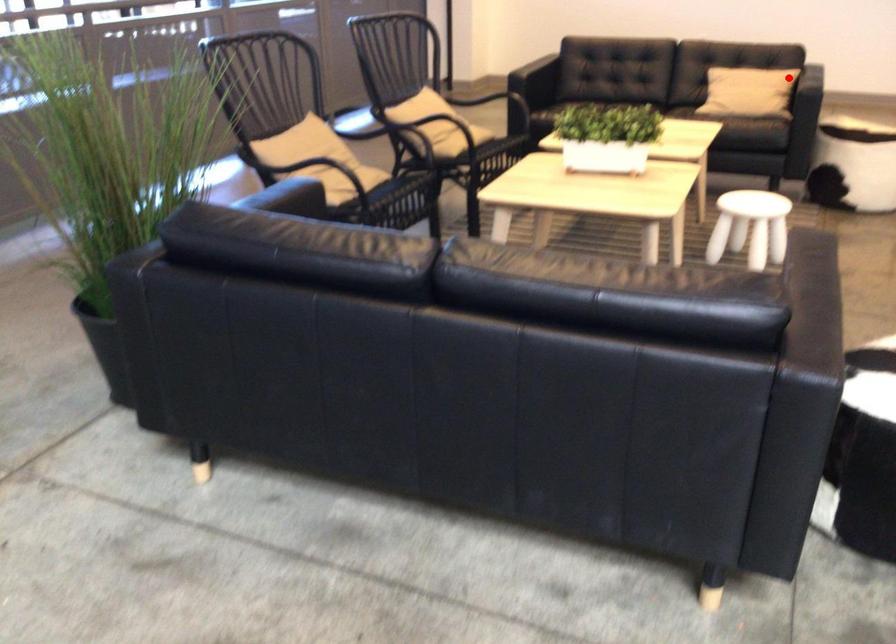
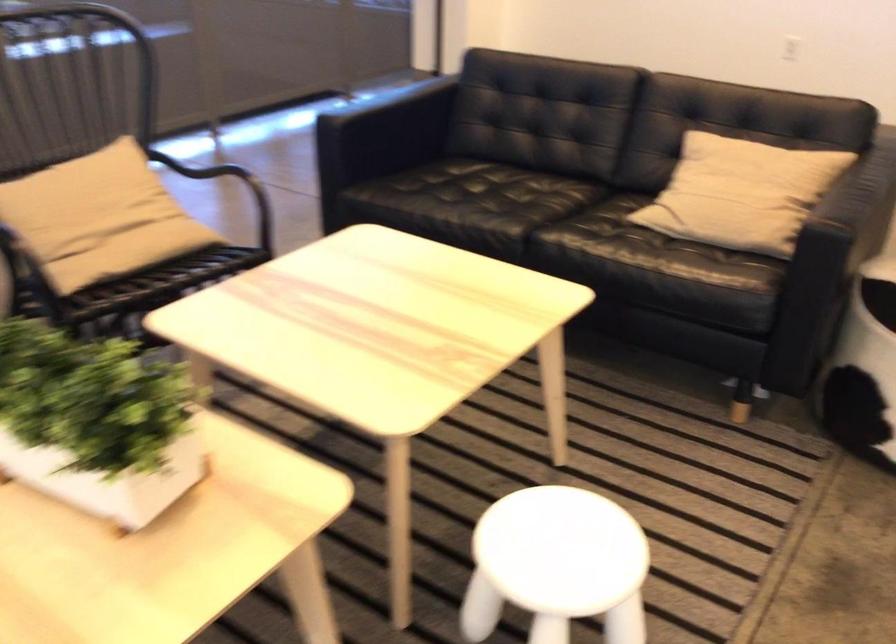
Where in the second image is the point corresponding to the highlighted location from the first image?

(741, 193)